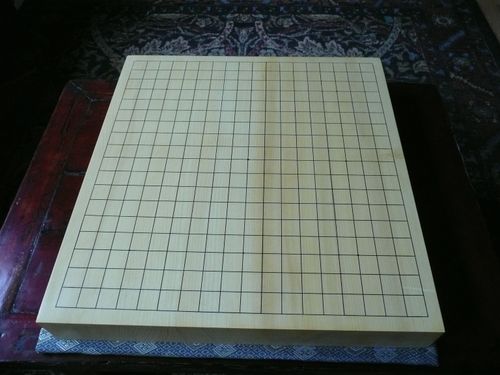
Identify the location of persian rug. (369, 28).